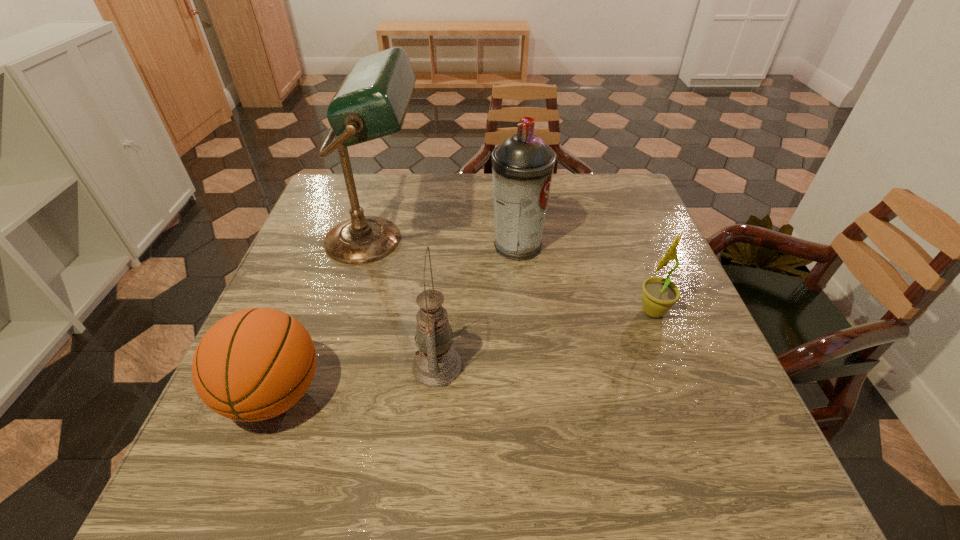
Where is `table lamp`? Image resolution: width=960 pixels, height=540 pixels. table lamp is located at coordinates (372, 101).

Where is `aerosol can`? This screenshot has width=960, height=540. aerosol can is located at coordinates (522, 166).

Where is `the third shortest object`? the third shortest object is located at coordinates coord(436,364).

What are the coordinates of `oil lamp` in the screenshot? It's located at (436, 364).

Identify the location of sunflower. (659, 294).

Identify the location of the rightmost object. (659, 294).

Where is `basketball`? basketball is located at coordinates (254, 364).

I want to click on vacant space located above the green lampshade of the tallest object, so click(x=527, y=240).

You are a GUI agent. You are given a task and a screenshot of the screen. Output one action in this format:
    pyautogui.click(x=<x>, y=<y>)
    Task: Click on the vacant space located 0.160m on the right of the second object from right to left
    The width and height of the screenshot is (960, 540).
    Given the screenshot: What is the action you would take?
    pyautogui.click(x=607, y=246)

You are a GUI agent. You are given a task and a screenshot of the screen. Output one action in this format:
    pyautogui.click(x=<x>, y=<y>)
    Task: Click on the vacant space located on the left of the third tallest object
    The image size is (960, 540).
    Given the screenshot: What is the action you would take?
    pyautogui.click(x=331, y=366)